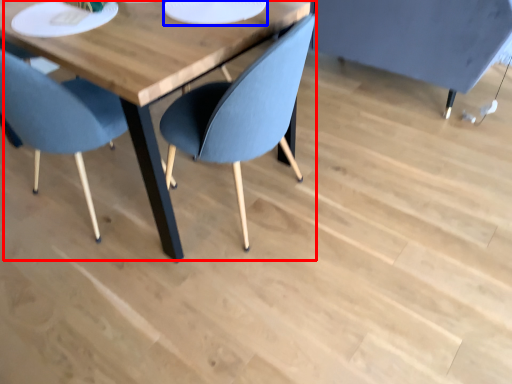
Question: Which point is closer to the camera, table (highlighted by a red box) or paper plate (highlighted by a blue box)?

Choices:
 (A) table
 (B) paper plate

Answer: (A)